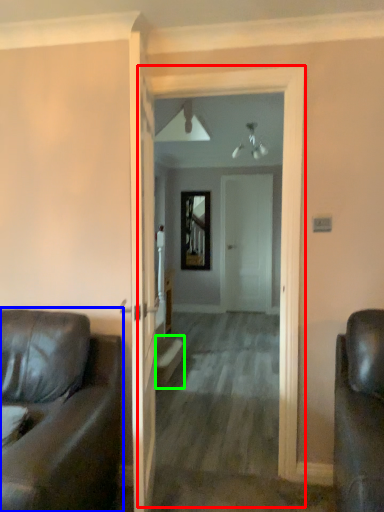
Question: Which is farther away from corridor (highlighted by a red box)? studio couch (highlighted by a blue box) or stairwell (highlighted by a green box)?

Choices:
 (A) studio couch
 (B) stairwell

Answer: (B)